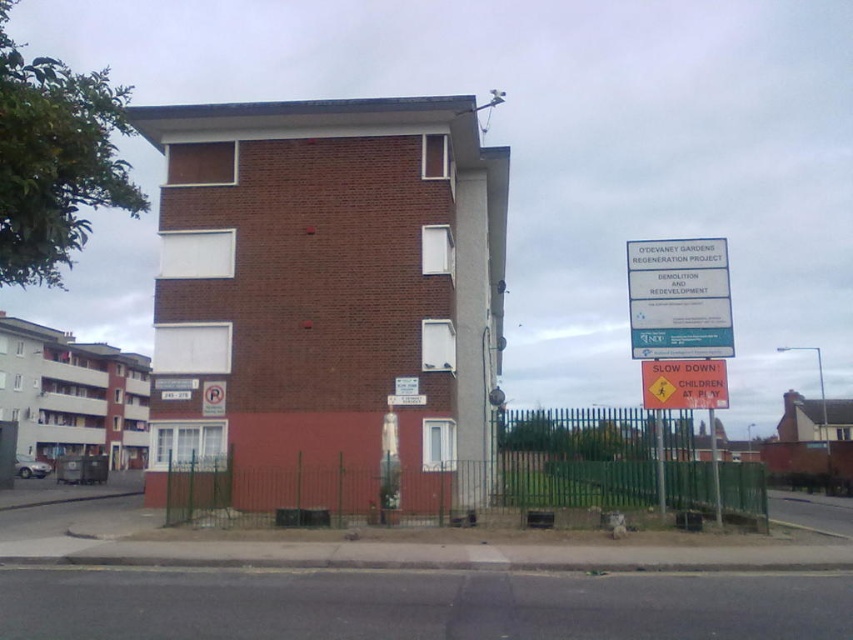
You are standing at the point marked by the coordinates point (467,493) in the image. What object are you facing?

The point (467,493) indicates the green metal fence at center, so you are facing the green metal fence at center.